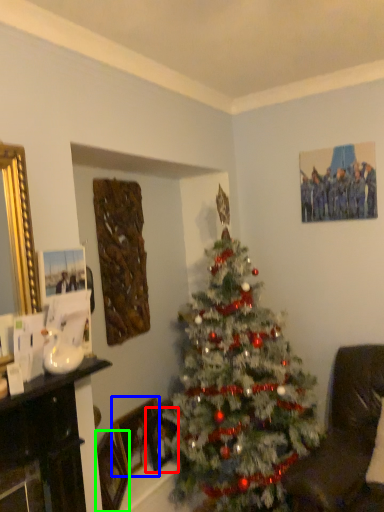
Question: Estimate the real-world distances between objects in this image. Which object is farther from picture frame (highlighted by a red box), picture frame (highlighted by a blue box) or picture frame (highlighted by a green box)?

Choices:
 (A) picture frame
 (B) picture frame

Answer: (B)